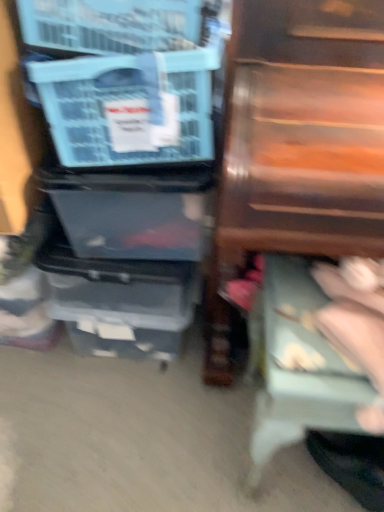
Question: Is blue plastic storage box at left further to the viewer compared to wooden drawer at right?

Choices:
 (A) no
 (B) yes

Answer: (B)

Question: Is blue plastic storage box at left located outside wooden drawer at right?

Choices:
 (A) no
 (B) yes

Answer: (B)

Question: Is blue plastic storage box at left thinner than wooden drawer at right?

Choices:
 (A) yes
 (B) no

Answer: (A)

Question: Does blue plastic storage box at left have a larger size compared to wooden drawer at right?

Choices:
 (A) no
 (B) yes

Answer: (A)

Question: Could you tell me if blue plastic storage box at left is turned towards wooden drawer at right?

Choices:
 (A) no
 (B) yes

Answer: (A)

Question: Considering the relative sizes of blue plastic storage box at left and wooden drawer at right in the image provided, is blue plastic storage box at left shorter than wooden drawer at right?

Choices:
 (A) no
 (B) yes

Answer: (B)

Question: From the image's perspective, is blue plastic storage box at left on top of light blue fabric step stool at lower right?

Choices:
 (A) no
 (B) yes

Answer: (B)

Question: Is blue plastic storage box at left in front of light blue fabric step stool at lower right?

Choices:
 (A) no
 (B) yes

Answer: (A)

Question: Would you say blue plastic storage box at left is outside light blue fabric step stool at lower right?

Choices:
 (A) yes
 (B) no

Answer: (A)

Question: Is blue plastic storage box at left to the right of light blue fabric step stool at lower right from the viewer's perspective?

Choices:
 (A) yes
 (B) no

Answer: (B)

Question: From a real-world perspective, is blue plastic storage box at left physically above light blue fabric step stool at lower right?

Choices:
 (A) yes
 (B) no

Answer: (A)

Question: Can you confirm if blue plastic storage box at left is shorter than light blue fabric step stool at lower right?

Choices:
 (A) no
 (B) yes

Answer: (B)

Question: Is blue plastic storage box at left located within light blue fabric step stool at lower right?

Choices:
 (A) yes
 (B) no

Answer: (B)